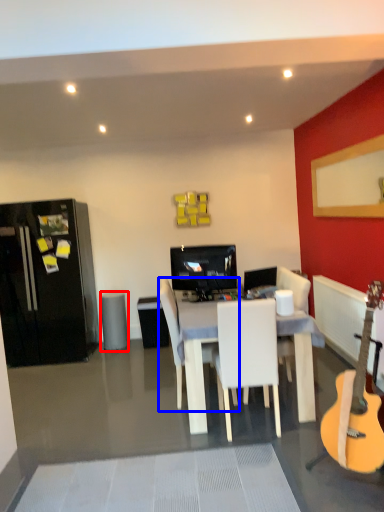
Question: Which object appears farthest to the camera in this image, trash bin/can (highlighted by a red box) or chair (highlighted by a blue box)?

Choices:
 (A) trash bin/can
 (B) chair

Answer: (A)